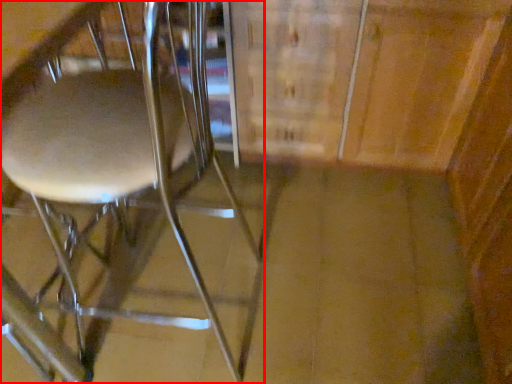
Question: Where is chair (annotated by the red box) located in relation to cabinetry in the image?

Choices:
 (A) right
 (B) left

Answer: (B)